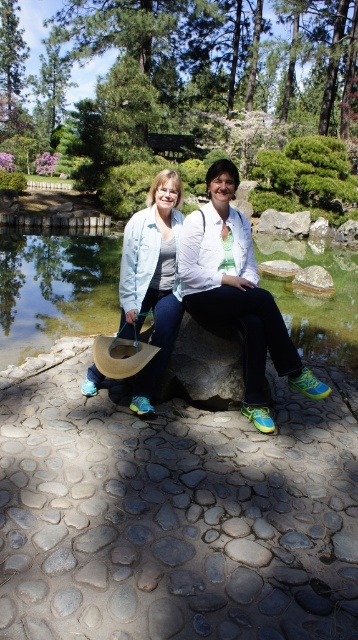
You are a tailor who needs to determine which jacket requires more fabric to make between the matte white jacket at center and the light blue denim jacket at center. Which one would you choose?

The matte white jacket at center requires more fabric because its width is larger than the light blue denim jacket at center.

You are planning to take a photo of the light blue denim jacket at center and the transparent glass lake at center. Since you want the lake to appear to the left of the jacket in the photo, is the current arrangement suitable?

Yes, the current arrangement is suitable because the transparent glass lake at center is already positioned to the left of the light blue denim jacket at center, which matches your desired composition.